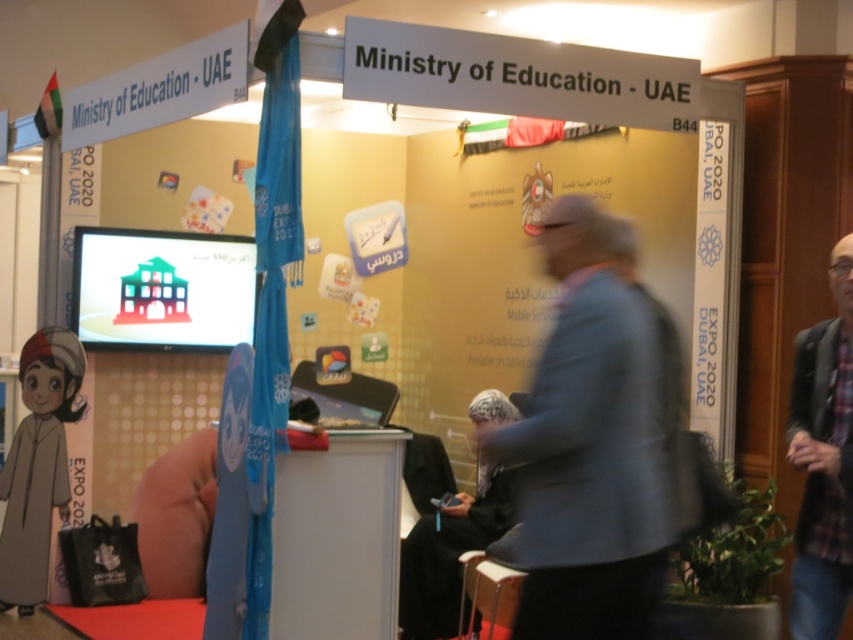
Is point (543, 552) farther from camera compared to point (786, 436)?

No, it is not.

Who is more forward, (635, 307) or (793, 577)?

Positioned in front is point (635, 307).

Locate an element on the screen. Image resolution: width=853 pixels, height=640 pixels. gray fabric jacket at center is located at coordinates (593, 440).